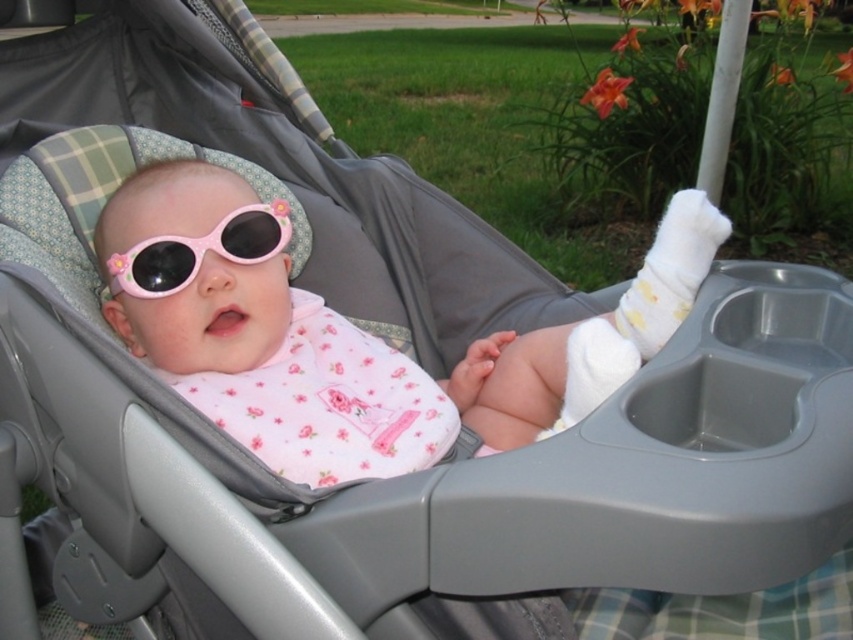
Is the position of pink glossy sunglasses at center more distant than that of pink plastic goggles at center?

No, it is in front of pink plastic goggles at center.

Which is below, pink glossy sunglasses at center or pink plastic goggles at center?

pink glossy sunglasses at center

Does point (213, 285) lie behind point (218, 253)?

That is False.

Locate an element on the screen. The image size is (853, 640). pink glossy sunglasses at center is located at coordinates (355, 336).